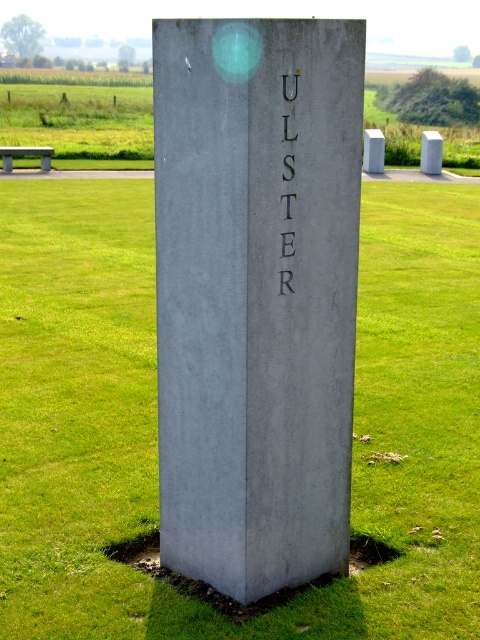
Can you confirm if gray concrete monument at center is taller than black metal text at center?

Correct, gray concrete monument at center is much taller as black metal text at center.

You are a GUI agent. You are given a task and a screenshot of the screen. Output one action in this format:
    pyautogui.click(x=<x>, y=<y>)
    Task: Click on the gray concrete monument at center
    
    Given the screenshot: What is the action you would take?
    click(255, 296)

Is point (60, 609) positioned behind point (214, 102)?

That is True.

Between point (391, 634) and point (297, 426), which one is positioned behind?

The point (297, 426) is behind.

Is point (35, 248) farther from viewer compared to point (346, 291)?

Yes, it is behind point (346, 291).

Where is `green grass at center`? The width and height of the screenshot is (480, 640). green grass at center is located at coordinates (156, 420).

Which is above, green grass at center or black metal text at center?

green grass at center is above.

Is green grass at center shorter than black metal text at center?

No, green grass at center is not shorter than black metal text at center.

Is point (410, 577) closer to camera compared to point (286, 138)?

No, it is not.

Locate an element on the screen. green grass at center is located at coordinates (156, 420).